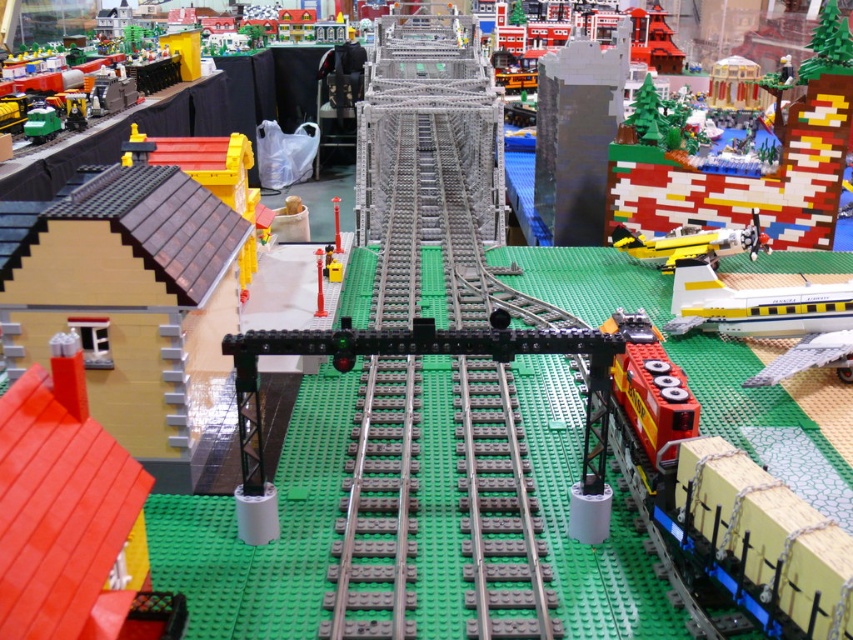
Question: Is smooth red roof at left further to the viewer compared to yellow matte airplane at lower right?

Choices:
 (A) no
 (B) yes

Answer: (A)

Question: Which of the following is the farthest from the observer?

Choices:
 (A) (97, 524)
 (B) (650, 177)
 (C) (741, 228)

Answer: (B)

Question: Which object is closer to the camera taking this photo?

Choices:
 (A) brick wall at upper right
 (B) yellow matte airplane at lower right
 (C) yellow matte airplane at upper right
 (D) smooth red roof at left

Answer: (D)

Question: Is brick wall at upper right further to camera compared to yellow matte airplane at lower right?

Choices:
 (A) no
 (B) yes

Answer: (B)

Question: In this image, where is smooth red roof at left located relative to brick wall at upper right?

Choices:
 (A) below
 (B) above

Answer: (A)

Question: Estimate the real-world distances between objects in this image. Which object is closer to the yellow matte airplane at upper right?

Choices:
 (A) brick wall at upper right
 (B) smooth red roof at left
 (C) yellow matte airplane at lower right

Answer: (A)